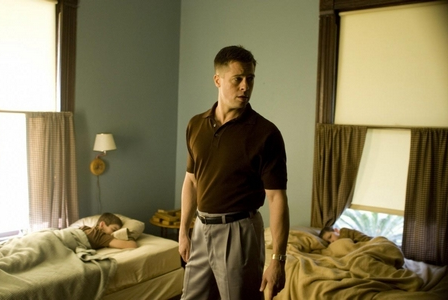
At what (x,y) coordinates should I click in order to perform the action: click on wall. Please return your answer as a coordinate pair (x, y). Looking at the image, I should click on (142, 53), (272, 28).